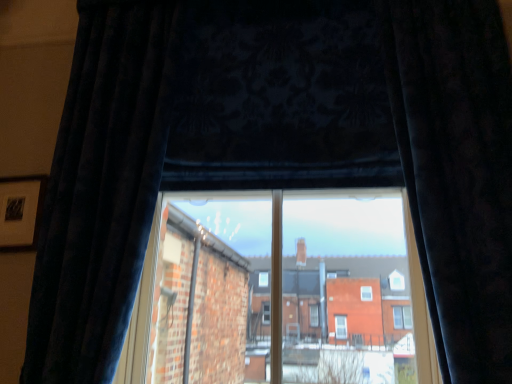
Question: Is velvet dark blue curtain at left, which is the second curtain in right-to-left order, not inside velvet dark blue curtain at right, the first curtain in the right-to-left sequence?

Choices:
 (A) no
 (B) yes

Answer: (B)

Question: Considering the relative sizes of velvet dark blue curtain at left, the first curtain from the left, and velvet dark blue curtain at right, the first curtain in the right-to-left sequence, in the image provided, is velvet dark blue curtain at left, the first curtain from the left, bigger than velvet dark blue curtain at right, the first curtain in the right-to-left sequence,?

Choices:
 (A) no
 (B) yes

Answer: (B)

Question: From the image's perspective, would you say velvet dark blue curtain at left, the first curtain from the left, is shown under velvet dark blue curtain at right, the first curtain in the right-to-left sequence?

Choices:
 (A) no
 (B) yes

Answer: (B)

Question: Is there a large distance between velvet dark blue curtain at left, the first curtain from the left, and velvet dark blue curtain at right, the second curtain when ordered from left to right?

Choices:
 (A) yes
 (B) no

Answer: (A)

Question: From a real-world perspective, is velvet dark blue curtain at left, which is the second curtain in right-to-left order, physically below velvet dark blue curtain at right, the first curtain in the right-to-left sequence?

Choices:
 (A) yes
 (B) no

Answer: (B)

Question: Considering the relative positions of velvet dark blue curtain at left, the first curtain from the left, and velvet dark blue curtain at right, the first curtain in the right-to-left sequence, in the image provided, is velvet dark blue curtain at left, the first curtain from the left, to the left of velvet dark blue curtain at right, the first curtain in the right-to-left sequence, from the viewer's perspective?

Choices:
 (A) no
 (B) yes

Answer: (B)

Question: From a real-world perspective, is velvet dark blue curtain at right, the first curtain in the right-to-left sequence, located higher than velvet dark blue curtain at left, the first curtain from the left?

Choices:
 (A) yes
 (B) no

Answer: (B)

Question: Is velvet dark blue curtain at right, the first curtain in the right-to-left sequence, placed right next to velvet dark blue curtain at left, the first curtain from the left?

Choices:
 (A) yes
 (B) no

Answer: (B)

Question: Is velvet dark blue curtain at right, the first curtain in the right-to-left sequence, shorter than velvet dark blue curtain at left, the first curtain from the left?

Choices:
 (A) yes
 (B) no

Answer: (A)

Question: Is velvet dark blue curtain at right, the first curtain in the right-to-left sequence, to the left of velvet dark blue curtain at left, which is the second curtain in right-to-left order, from the viewer's perspective?

Choices:
 (A) yes
 (B) no

Answer: (B)

Question: Considering the relative sizes of velvet dark blue curtain at right, the second curtain when ordered from left to right, and velvet dark blue curtain at left, which is the second curtain in right-to-left order, in the image provided, is velvet dark blue curtain at right, the second curtain when ordered from left to right, smaller than velvet dark blue curtain at left, which is the second curtain in right-to-left order,?

Choices:
 (A) no
 (B) yes

Answer: (B)

Question: From a real-world perspective, is velvet dark blue curtain at right, the second curtain when ordered from left to right, physically below velvet dark blue curtain at left, the first curtain from the left?

Choices:
 (A) yes
 (B) no

Answer: (A)

Question: Looking at their shapes, would you say velvet dark blue curtain at left, which is the second curtain in right-to-left order, is wider or thinner than velvet dark blue curtain at right, the first curtain in the right-to-left sequence?

Choices:
 (A) wide
 (B) thin

Answer: (B)